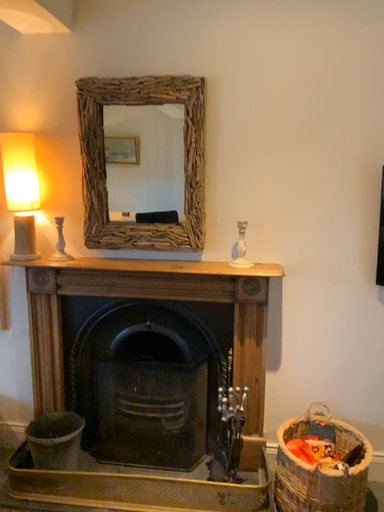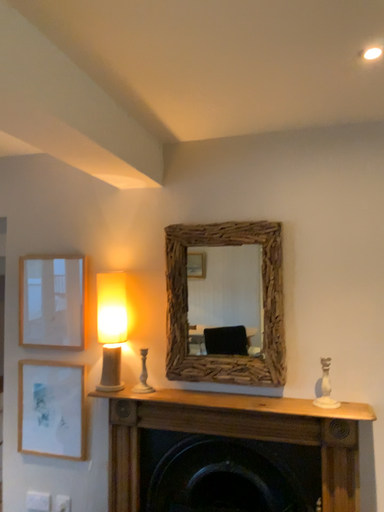
Question: How did the camera likely rotate when shooting the video?

Choices:
 (A) rotated right
 (B) rotated left

Answer: (B)